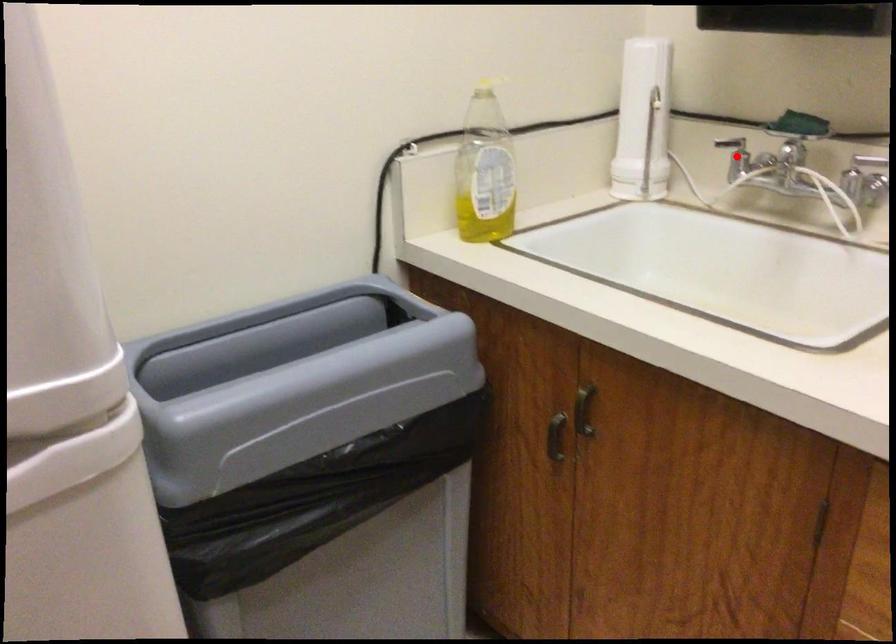
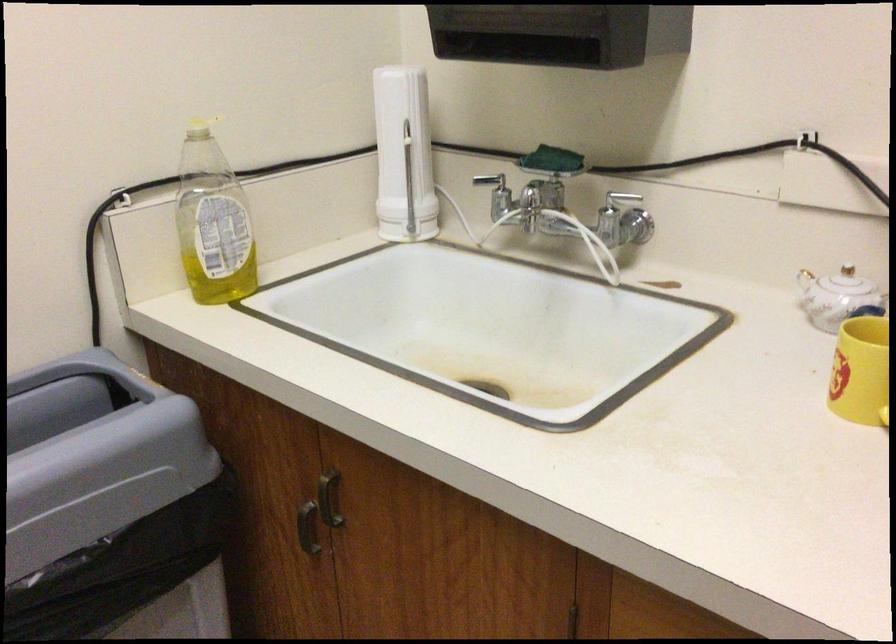
Where in the second image is the point corresponding to the highlighted location from the first image?

(496, 194)